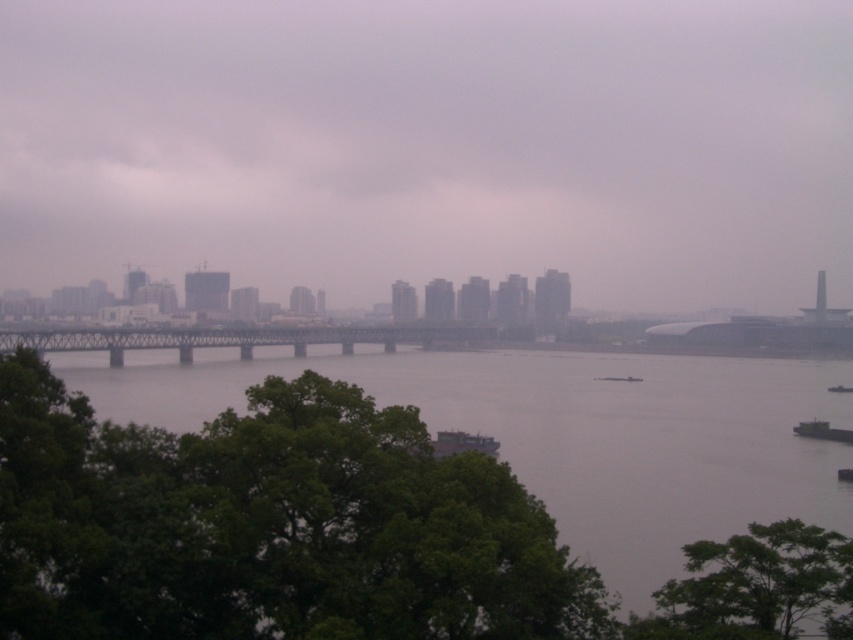
Question: Which of the following is the farthest from the observer?

Choices:
 (A) metallic gray boat at center
 (B) green leafy tree at lower right
 (C) matte gray bridge at center
 (D) gray metallic bridge at center

Answer: (C)

Question: Is matte gray bridge at center positioned in front of metallic gray boat at center?

Choices:
 (A) no
 (B) yes

Answer: (A)

Question: Which point is closer to the camera?

Choices:
 (A) metallic gray boat at center
 (B) green leafy tree at lower right
 (C) matte gray bridge at center

Answer: (B)

Question: Is green leafy tree at lower right below gray metallic bridge at center?

Choices:
 (A) yes
 (B) no

Answer: (A)

Question: Can you confirm if matte gray bridge at center is bigger than gray concrete bridge at center?

Choices:
 (A) yes
 (B) no

Answer: (A)

Question: Which of the following is the farthest from the observer?

Choices:
 (A) (491, 444)
 (B) (175, 616)

Answer: (A)